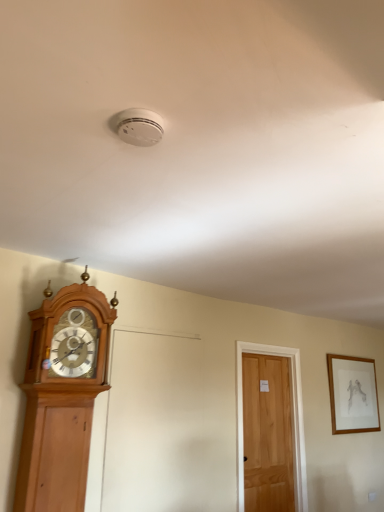
Question: From the image's perspective, is light brown wooden door at center-right located above or below light brown wooden clock at left?

Choices:
 (A) below
 (B) above

Answer: (A)

Question: Is light brown wooden door at center-right wider or thinner than light brown wooden clock at left?

Choices:
 (A) thin
 (B) wide

Answer: (A)

Question: Estimate the real-world distances between objects in this image. Which object is closer to the light brown wooden door at center-right?

Choices:
 (A) wooden framed drawing at upper right
 (B) light brown wooden clock at left

Answer: (A)

Question: Estimate the real-world distances between objects in this image. Which object is closer to the light brown wooden clock at left?

Choices:
 (A) wooden framed drawing at upper right
 (B) light brown wooden door at center-right

Answer: (B)